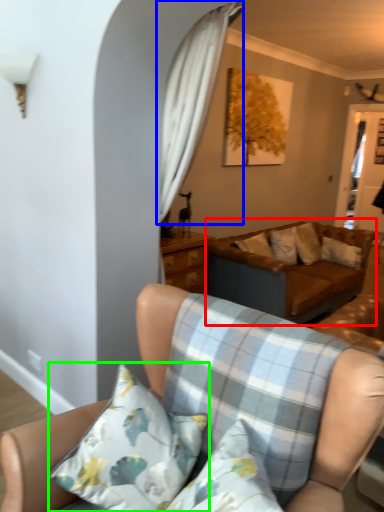
Question: Based on their relative distances, which object is farther from studio couch (highlighted by a red box)? Choose from curtain (highlighted by a blue box) and pillow (highlighted by a green box).

Choices:
 (A) curtain
 (B) pillow

Answer: (B)